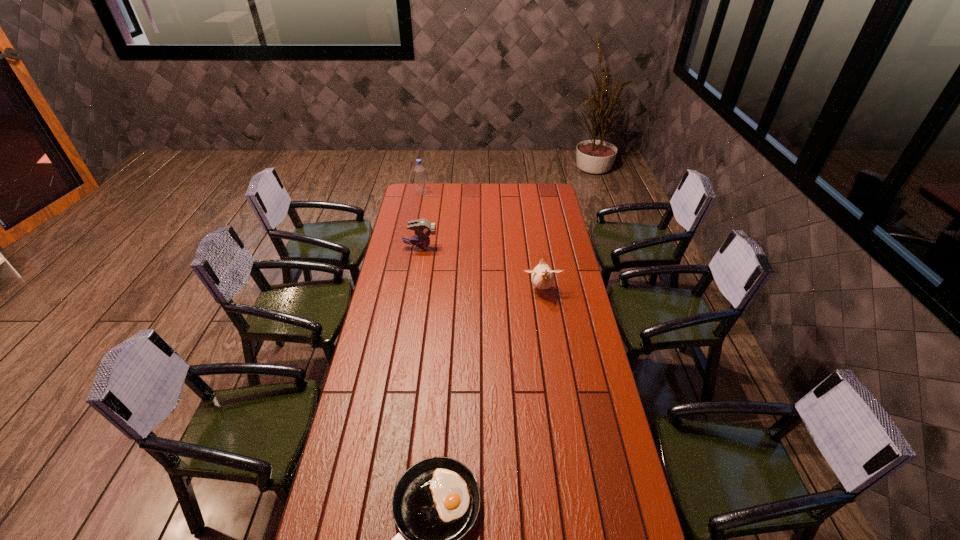
Locate an element on the screen. bottle at the left edge is located at coordinates (420, 180).

Find the location of `bird present at the left edge`. bird present at the left edge is located at coordinates (423, 228).

Where is `object at the right edge`? The image size is (960, 540). object at the right edge is located at coordinates pyautogui.click(x=542, y=277).

Where is `object present at the far left corner`? Image resolution: width=960 pixels, height=540 pixels. object present at the far left corner is located at coordinates (420, 180).

This screenshot has height=540, width=960. I want to click on vacant space at the left edge, so coord(410,275).

The image size is (960, 540). I want to click on vacant space at the right edge of the desktop, so click(553, 227).

Identify the location of empty space that is in between the bottle and the rightmost object. The width and height of the screenshot is (960, 540). point(482,242).

I want to click on free space between the rightmost object and the farthest object, so click(x=482, y=242).

The width and height of the screenshot is (960, 540). I want to click on unoccupied area between the left bird and the rightmost object, so click(x=481, y=269).

This screenshot has width=960, height=540. I want to click on free space between the rightmost object and the bottle, so click(482, 242).